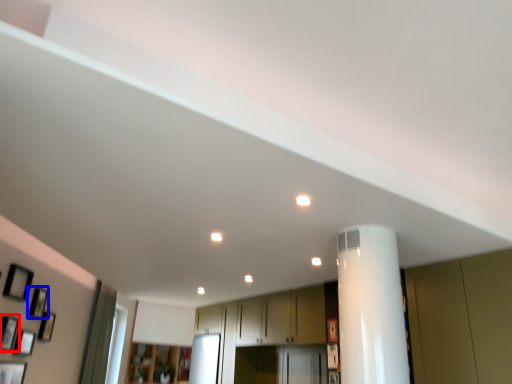
Question: Which point is closer to the camera, picture frame (highlighted by a red box) or picture frame (highlighted by a blue box)?

Choices:
 (A) picture frame
 (B) picture frame

Answer: (A)